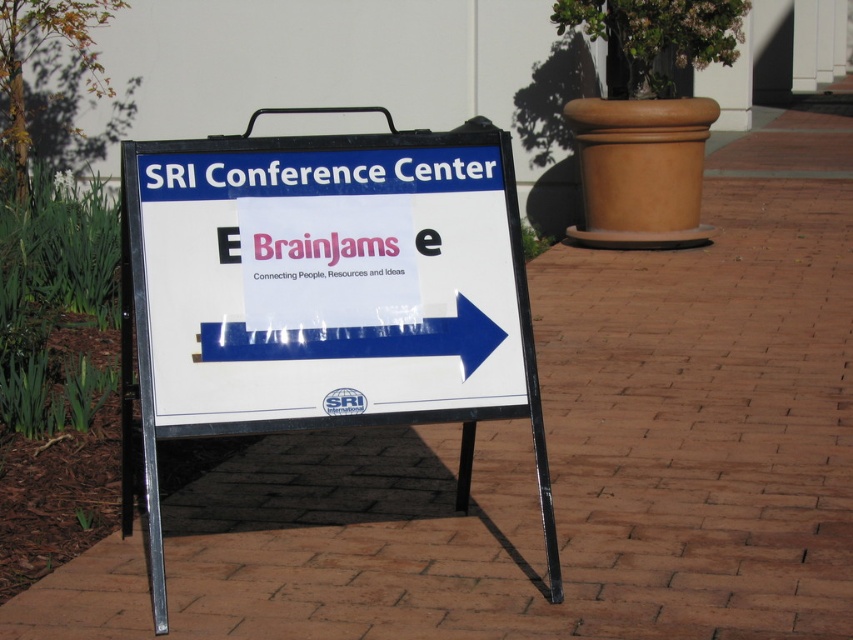
You are a visitor at the conference center and need to find the BrainJams event. You see the white plastic sign at center and the blue glossy arrow at center. Which object should you follow to locate the event?

The blue glossy arrow at center points to the right, indicating the direction to the BrainJams event. Since the blue glossy arrow at center is smaller than the white plastic sign at center, you should follow the blue glossy arrow at center as it specifically directs towards the event.